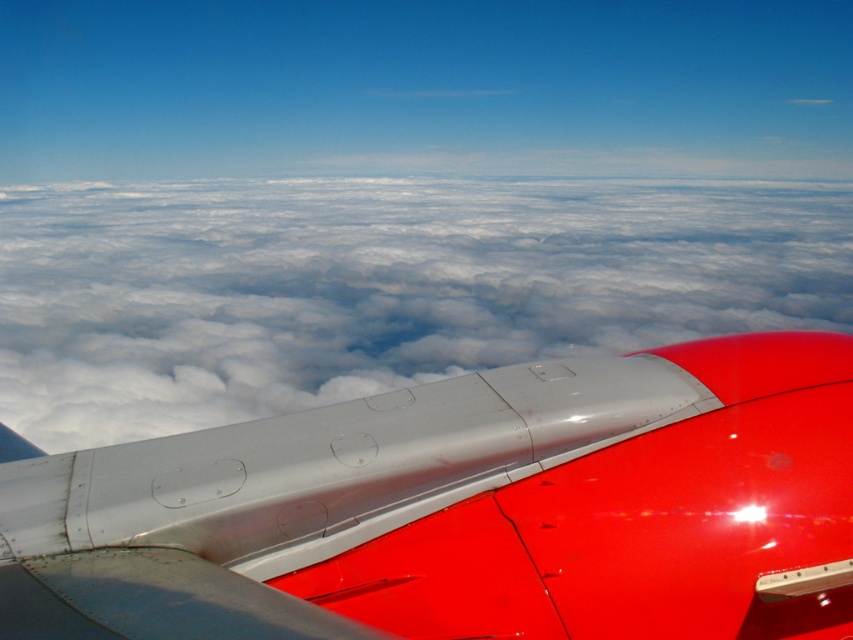
You are a passenger sitting in the airplane and looking out the window. You notice the metallic silver winglet at upper right and the cloudy white at upper center. Which object appears larger in the view?

The cloudy white at upper center appears larger than the metallic silver winglet at upper right.

You are a passenger sitting by the window on an airplane. You notice the metallic silver winglet at upper right and the cloudy white at upper center outside. Which object is nearer to you?

The metallic silver winglet at upper right is closer to the viewer than the cloudy white at upper center.

You are a passenger on the airplane and want to know which object in the scene is narrower between the metallic silver winglet at upper right and the cloudy white at upper center. Can you tell me?

The metallic silver winglet at upper right has a lesser width compared to cloudy white at upper center, so the metallic silver winglet at upper right is narrower.